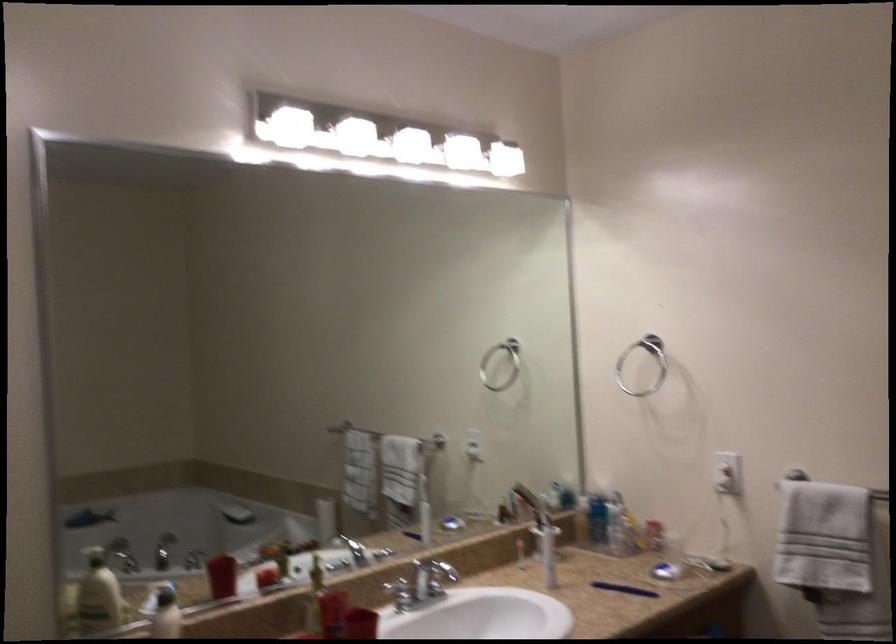
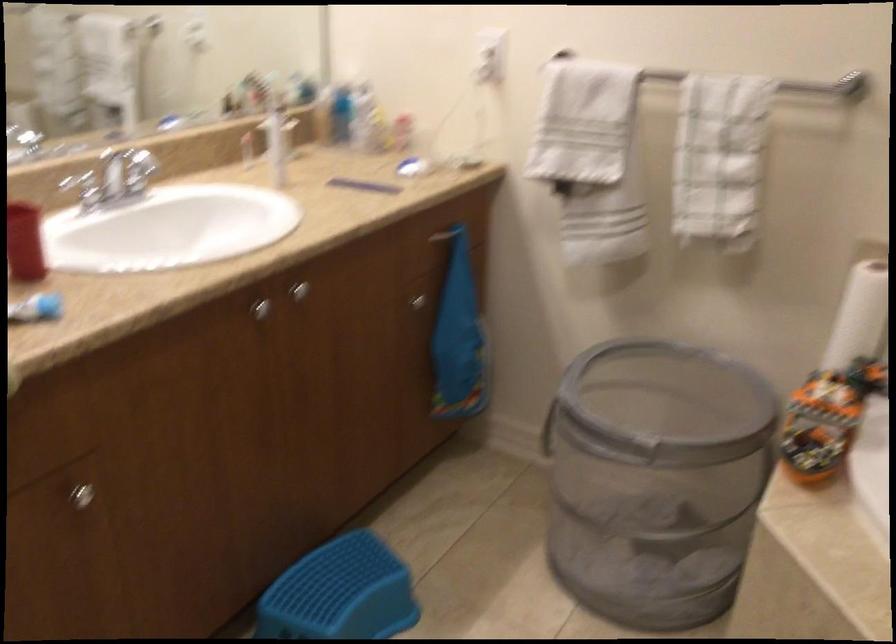
The images are taken continuously from a first-person perspective. In which direction are you moving?

The cameraman walked toward right, forward.